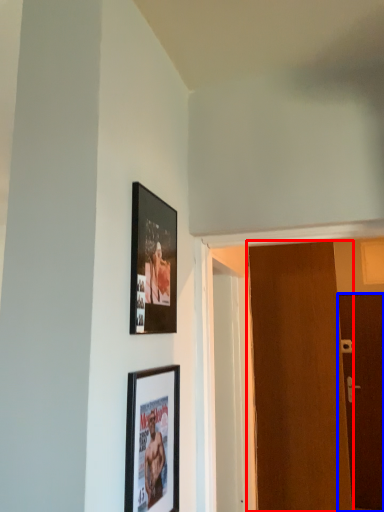
Question: Which object appears farthest to the camera in this image, door (highlighted by a red box) or door (highlighted by a blue box)?

Choices:
 (A) door
 (B) door

Answer: (B)